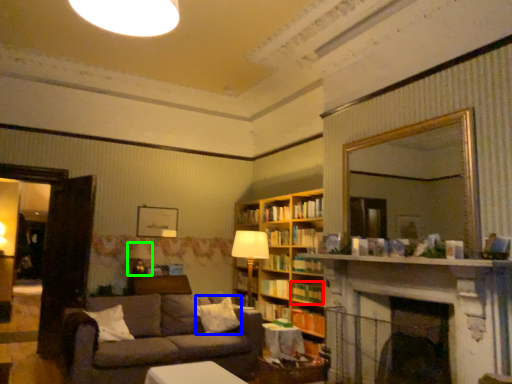
Question: Based on their relative distances, which object is farther from book (highlighted by a red box)? Choose from pillow (highlighted by a blue box) and table lamp (highlighted by a green box).

Choices:
 (A) pillow
 (B) table lamp

Answer: (B)